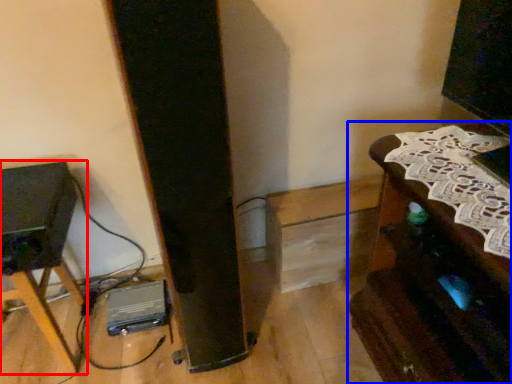
Question: Which point is further to the camera, furniture (highlighted by a red box) or furniture (highlighted by a blue box)?

Choices:
 (A) furniture
 (B) furniture

Answer: (A)